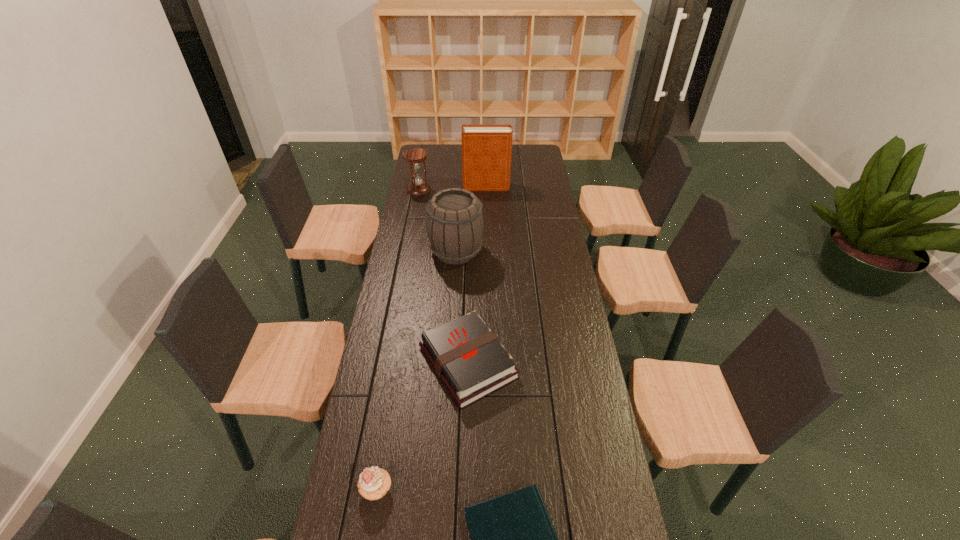
The image size is (960, 540). In order to click on free region located on the open cover of the tallest book in this screenshot , I will do `click(441, 187)`.

Identify the location of vacant area situated 0.340m on the right of the fifth shortest object. The height and width of the screenshot is (540, 960). (561, 251).

Identify the location of vacant space located 0.330m on the front of the hourglass. click(x=410, y=235).

I want to click on free space located 0.070m on the front of the cupcake, so click(369, 535).

Locate an element on the screen. The height and width of the screenshot is (540, 960). free space located on the right of the second nearest book is located at coordinates (536, 362).

Where is `wine bucket that is at the left edge`? Image resolution: width=960 pixels, height=540 pixels. wine bucket that is at the left edge is located at coordinates point(455,223).

At what (x,y) coordinates should I click in order to perform the action: click on hourglass at the left edge. Please return your answer as a coordinate pair (x, y). This screenshot has width=960, height=540. Looking at the image, I should click on (414, 156).

The width and height of the screenshot is (960, 540). In order to click on cupcake that is at the left edge in this screenshot , I will do `click(374, 482)`.

In the image, there is a desktop. Find the location of `free space at the far edge`. free space at the far edge is located at coordinates (460, 154).

Locate an element on the screen. vacant space at the left edge is located at coordinates (357, 469).